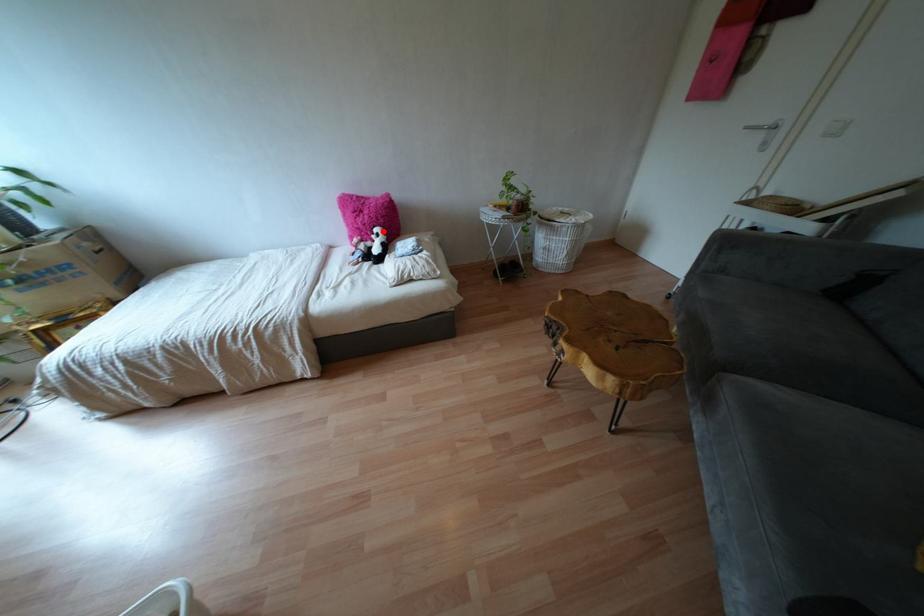
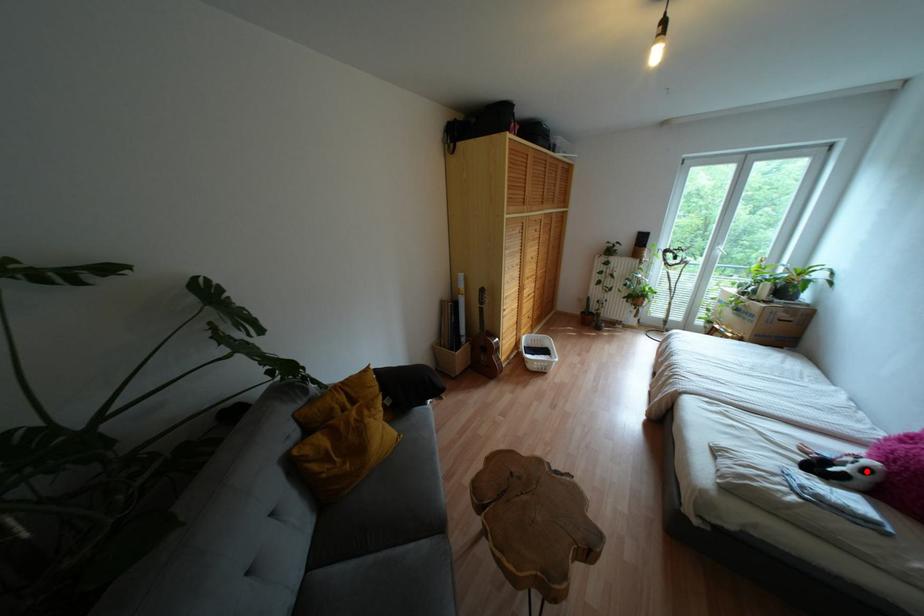
I am providing you with two images of the same scene from different viewpoints. A red point is marked on the first image and another point is marked on the second image. Does the point marked in image1 correspond to the same location as the one in image2?

Yes